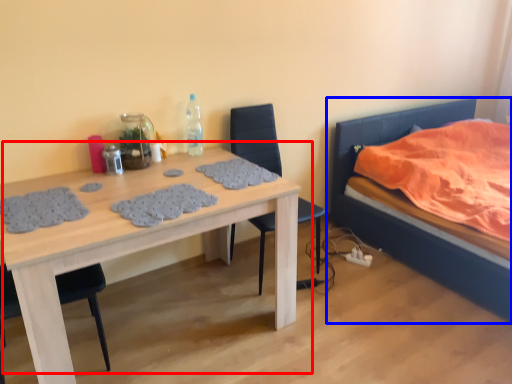
Question: Which object appears closest to the camera in this image, table (highlighted by a red box) or bed (highlighted by a blue box)?

Choices:
 (A) table
 (B) bed

Answer: (A)